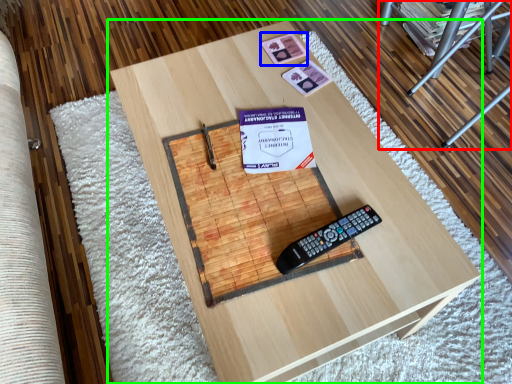
Question: Which object is the farthest from furniture (highlighted by a red box)? Choose among these: square (highlighted by a blue box) or table (highlighted by a green box).

Choices:
 (A) square
 (B) table

Answer: (B)